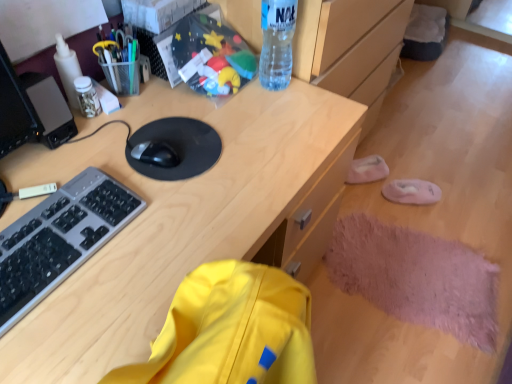
Find the location of a particular element. Image resolution: width=512 pixels, height=384 pixels. free area in between transparent plastic bottle at upper center, positioned as the first bottle in right-to-left order, and black matte mousepad at center is located at coordinates (233, 105).